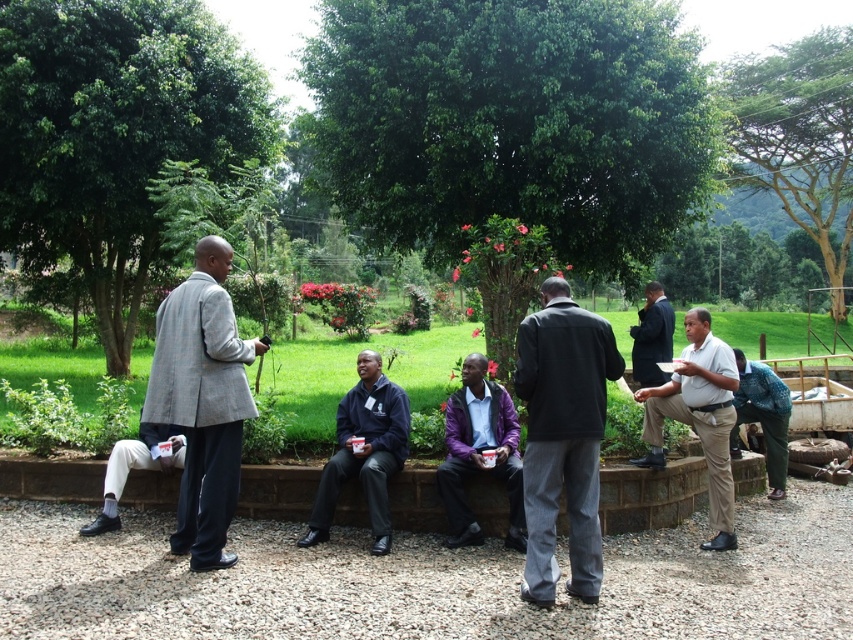
Does white cotton shirt at right appear under purple matte jacket at center?

Actually, white cotton shirt at right is above purple matte jacket at center.

Does white cotton shirt at right have a lesser width compared to purple matte jacket at center?

Correct, white cotton shirt at right's width is less than purple matte jacket at center's.

Which is in front, point (697, 403) or point (445, 406)?

Point (697, 403) is more forward.

Identify the location of white cotton shirt at right. [698, 417].

Does point (706, 419) come in front of point (654, 314)?

That is True.

Can you confirm if white cotton shirt at right is positioned below dark blue suit at center?

No.

Does point (712, 339) come farther from viewer compared to point (648, 308)?

That is False.

Locate an element on the screen. This screenshot has height=640, width=853. white cotton shirt at right is located at coordinates (698, 417).

From the picture: Can you confirm if dark blue fabric jacket at center is wider than textured blue shirt at lower right?

No, dark blue fabric jacket at center is not wider than textured blue shirt at lower right.

Which is in front, point (312, 506) or point (770, 468)?

Point (312, 506) is in front.

Does point (376, 472) come closer to viewer compared to point (756, 419)?

Yes, point (376, 472) is closer to viewer.

You are a GUI agent. You are given a task and a screenshot of the screen. Output one action in this format:
    pyautogui.click(x=<x>, y=<y>)
    Task: Click on the dark blue fabric jacket at center
    The width and height of the screenshot is (853, 640).
    Given the screenshot: What is the action you would take?
    pyautogui.click(x=364, y=451)